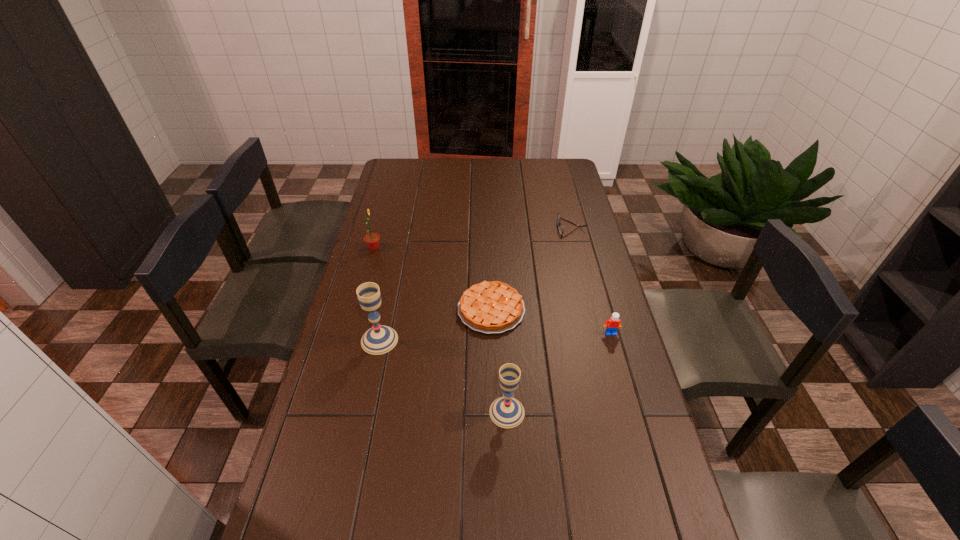
Please point a spot on the right to add another chalice. Please provide its 2D coordinates. Your answer should be formatted as a tuple, i.e. [(x, y)], where the tuple contains the x and y coordinates of a point satisfying the conditions above.

[(680, 510)]